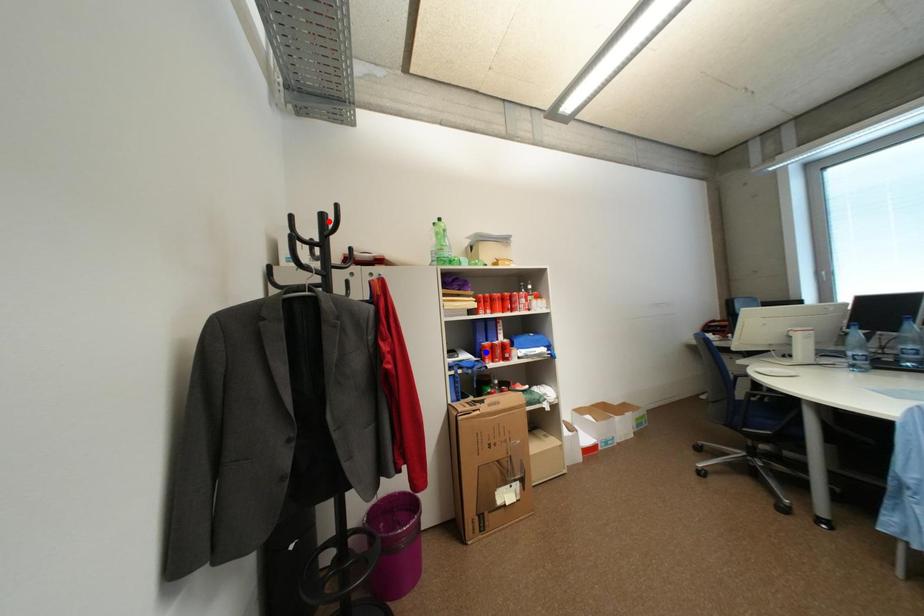
Question: Two points are marked on the image. Which point is closer to the camera?

Choices:
 (A) Blue point is closer.
 (B) Red point is closer.

Answer: (B)